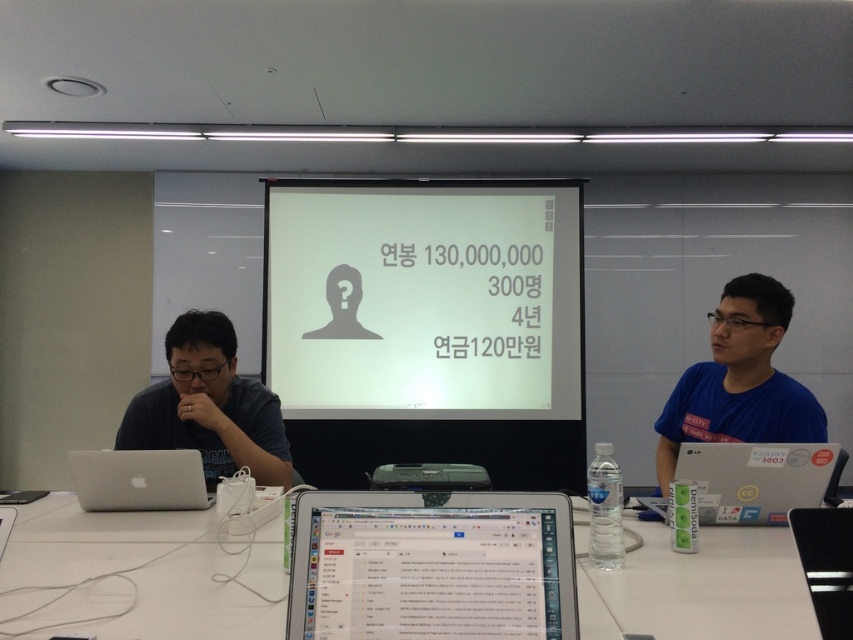
You are an office worker who needs to place a 15 cm tall coffee mug on the white plastic table at center without it falling off. Considering the table is under the dark gray shirt at left, where should you place the mug to avoid it being knocked off by the shirt?

The white plastic table at center is positioned under dark gray shirt at left, so placing the mug on the side of the table opposite to the shirt would prevent it from being knocked off.

You are standing at the back of the room and want to walk to the white plastic table at center. There is a dark gray shirt at left in your path. Which object should you move around first?

You should move around the dark gray shirt at left first because the white plastic table at center is closer to you, so the dark gray shirt at left is in front of it and blocking your path.

You are standing in the conference room and want to take a photo of the two points mentioned. Which point, point (589, 625) or point (225, 368), is closer to your camera when taking the photo?

Point 0.972, 0.692 is closer to the camera than point (225, 368).